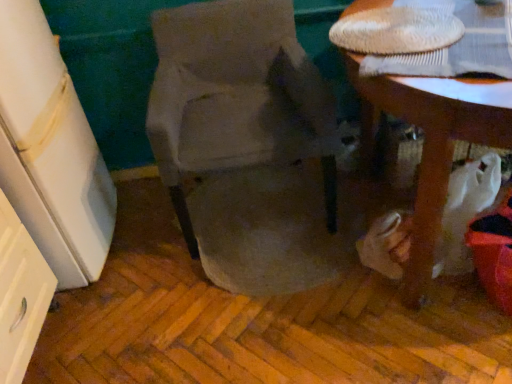
Question: From a real-world perspective, relative to suede-like beige chair at center, is wooden table at lower right vertically above or below?

Choices:
 (A) below
 (B) above

Answer: (A)

Question: Is wooden table at lower right taller or shorter than suede-like beige chair at center?

Choices:
 (A) short
 (B) tall

Answer: (B)

Question: Which object is the closest to the white glossy drawer at left?

Choices:
 (A) suede-like beige chair at center
 (B) wooden table at lower right

Answer: (A)

Question: Estimate the real-world distances between objects in this image. Which object is farther from the white glossy drawer at left?

Choices:
 (A) wooden table at lower right
 (B) suede-like beige chair at center

Answer: (A)